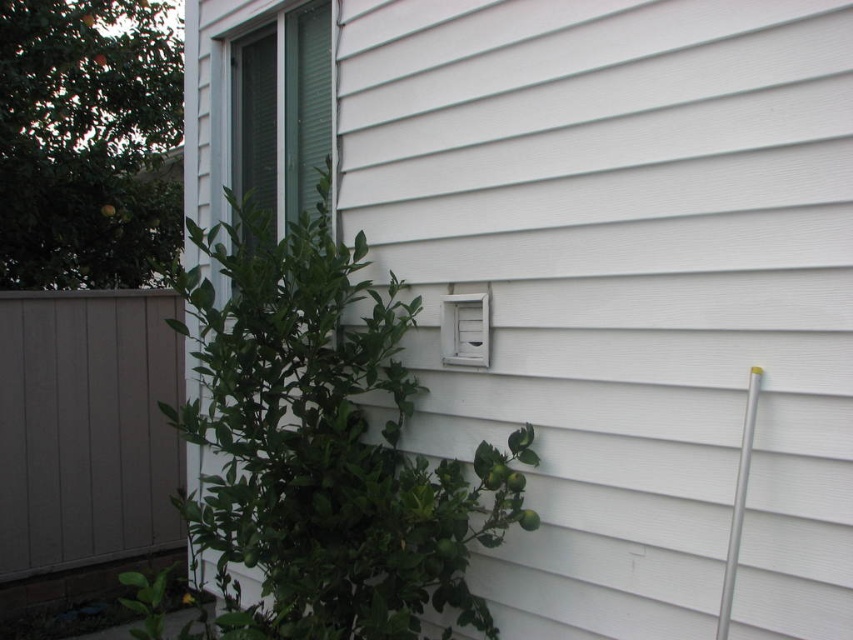
You are a painter who needs to place a ladder between the gray wood fence at left and the silver metallic pole at right. The ladder is 15 feet long. Can the ladder fit between them without touching either object?

The gray wood fence at left and silver metallic pole at right are 16.20 feet apart. Since the ladder is 15 feet long, it can fit between them without touching either object because there is enough space.

You are a gardener who needs to water both the green leafy plant at center and the silver metallic pole at right. The watering can you have can only reach 5 feet. Can you water both objects without moving the watering can?

The green leafy plant at center and the silver metallic pole at right are 5.57 feet apart from each other. Since the watering can can only reach 5 feet, you cannot water both objects without moving the watering can because the distance between them exceeds the can reach.